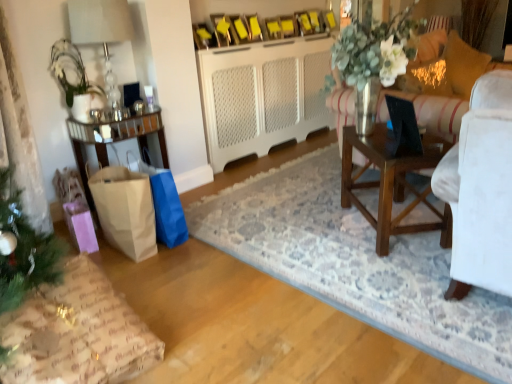
In order to face brown wooden table at center, the second table in the left-to-right sequence, should I rotate leftwards or rightwards?

Turn right approximately 18.102 degrees to face it.

What is the approximate height of white textured cabinet at center?

The height of white textured cabinet at center is 35.87 inches.

Identify the location of gold textured pillow at upper right, which appears as the 2th pillow when viewed from the left. (463, 65).

What do you see at coordinates (403, 128) in the screenshot? I see `black plastic laptop at right` at bounding box center [403, 128].

In order to face black plastic laptop at right, should I rotate leftwards or rightwards?

To face it directly, rotate right by 18.761 degrees.

Locate an element on the screen. The image size is (512, 384). white fabric pillow at upper right, acting as the first pillow starting from the left is located at coordinates (426, 79).

Where is `brown wooden table at center, which ranks as the 1th table in right-to-left order`? brown wooden table at center, which ranks as the 1th table in right-to-left order is located at coordinates (392, 184).

How many degrees apart are the facing directions of white glass lamp at upper left and gold textured pillow at upper right, which appears as the 2th pillow when viewed from the left?

The angle between the facing direction of white glass lamp at upper left and the facing direction of gold textured pillow at upper right, which appears as the 2th pillow when viewed from the left, is 34.2 degrees.

At what (x,y) coordinates should I click in order to perform the action: click on the 1st pillow directly beneath the white glass lamp at upper left (from a real-world perspective). Please return your answer as a coordinate pair (x, y). Looking at the image, I should click on (463, 65).

Which of these two, white glass lamp at upper left or gold textured pillow at upper right, placed as the 1th pillow when sorted from right to left, stands taller?

white glass lamp at upper left.

Which object is thinner, white glass lamp at upper left or gold textured pillow at upper right, which appears as the 2th pillow when viewed from the left?

Thinner between the two is white glass lamp at upper left.

Can brown paper bag at lower left, the 1th shopping bag positioned from the left, be found inside gold textured pillow at upper right, placed as the 1th pillow when sorted from right to left?

No, brown paper bag at lower left, the 1th shopping bag positioned from the left, is not a part of gold textured pillow at upper right, placed as the 1th pillow when sorted from right to left.

Looking at this image, which is in front, gold textured pillow at upper right, which appears as the 2th pillow when viewed from the left, or brown paper bag at lower left, the 2th shopping bag when ordered from right to left?

brown paper bag at lower left, the 2th shopping bag when ordered from right to left, is more forward.

Considering the relative positions of gold textured pillow at upper right, placed as the 1th pillow when sorted from right to left, and brown paper bag at lower left, the 2th shopping bag when ordered from right to left, in the image provided, is gold textured pillow at upper right, placed as the 1th pillow when sorted from right to left, to the left of brown paper bag at lower left, the 2th shopping bag when ordered from right to left, from the viewer's perspective?

In fact, gold textured pillow at upper right, placed as the 1th pillow when sorted from right to left, is to the right of brown paper bag at lower left, the 2th shopping bag when ordered from right to left.

Who is smaller, brown paper bag at lower left, the 2th shopping bag when ordered from right to left, or white fabric pillow at upper right, which is the 2th pillow from right to left?

white fabric pillow at upper right, which is the 2th pillow from right to left, is smaller.

Which shopping bag is the 2nd one when counting from the front of the white fabric pillow at upper right, acting as the first pillow starting from the left? Please provide its 2D coordinates.

[(125, 210)]

From their relative heights in the image, would you say brown paper bag at lower left, the 1th shopping bag positioned from the left, is taller or shorter than white fabric pillow at upper right, acting as the first pillow starting from the left?

brown paper bag at lower left, the 1th shopping bag positioned from the left, is taller than white fabric pillow at upper right, acting as the first pillow starting from the left.

Relative to brown paper bag at left, which is the 1th table from left to right, is white glass lamp at upper left in front or behind?

Clearly, white glass lamp at upper left is in front of brown paper bag at left, which is the 1th table from left to right.

Does white glass lamp at upper left touch brown paper bag at left, which is the 1th table from left to right?

No, white glass lamp at upper left is not making contact with brown paper bag at left, which is the 1th table from left to right.

Is white glass lamp at upper left bigger or smaller than brown paper bag at left, which is the 1th table from left to right?

Considering their sizes, white glass lamp at upper left takes up less space than brown paper bag at left, which is the 1th table from left to right.

Is white fabric pillow at upper right, which is the 2th pillow from right to left, positioned with its back to black plastic laptop at right?

No, white fabric pillow at upper right, which is the 2th pillow from right to left, is not facing away from black plastic laptop at right.

What's the angular difference between white fabric pillow at upper right, which is the 2th pillow from right to left, and black plastic laptop at right's facing directions?

The facing directions of white fabric pillow at upper right, which is the 2th pillow from right to left, and black plastic laptop at right are 67.7 degrees apart.

How much distance is there between white fabric pillow at upper right, which is the 2th pillow from right to left, and black plastic laptop at right?

The distance of white fabric pillow at upper right, which is the 2th pillow from right to left, from black plastic laptop at right is 1.27 meters.

Between white fabric pillow at upper right, which is the 2th pillow from right to left, and black plastic laptop at right, which one appears on the right side from the viewer's perspective?

white fabric pillow at upper right, which is the 2th pillow from right to left, is more to the right.

Would you say brown paper bag at left, the 2th table from the right, is a long distance from wrapping paper gift at lower left?

Yes, brown paper bag at left, the 2th table from the right, and wrapping paper gift at lower left are quite far apart.

Is brown paper bag at left, which is the 1th table from left to right, not within wrapping paper gift at lower left?

Absolutely, brown paper bag at left, which is the 1th table from left to right, is external to wrapping paper gift at lower left.

Is brown paper bag at left, the 2th table from the right, oriented towards wrapping paper gift at lower left?

No, brown paper bag at left, the 2th table from the right, is not turned towards wrapping paper gift at lower left.

From a real-world perspective, is brown paper bag at left, which is the 1th table from left to right, physically located above or below wrapping paper gift at lower left?

brown paper bag at left, which is the 1th table from left to right, is situated higher than wrapping paper gift at lower left in the real world.

How much distance is there between brown paper bag at lower left, the 2th shopping bag when ordered from right to left, and brown paper bag at lower left, the 1th shopping bag from the right?

brown paper bag at lower left, the 2th shopping bag when ordered from right to left, is 13.03 centimeters away from brown paper bag at lower left, the 1th shopping bag from the right.

Considering the sizes of objects brown paper bag at lower left, the 2th shopping bag when ordered from right to left, and brown paper bag at lower left, the 1th shopping bag from the right, in the image provided, who is thinner, brown paper bag at lower left, the 2th shopping bag when ordered from right to left, or brown paper bag at lower left, the 1th shopping bag from the right,?

brown paper bag at lower left, the 1th shopping bag from the right.

In order to click on shopping bag that appears below the brown paper bag at lower left, the 1th shopping bag from the right (from the image's perspective) in this screenshot , I will do `click(125, 210)`.

How many degrees apart are the facing directions of brown paper bag at lower left, the 2th shopping bag when ordered from right to left, and brown paper bag at lower left, the 1th shopping bag from the right?

There is a 1.72-degree angle between the facing directions of brown paper bag at lower left, the 2th shopping bag when ordered from right to left, and brown paper bag at lower left, the 1th shopping bag from the right.

The width and height of the screenshot is (512, 384). What are the coordinates of `pillow that is the 1st one below the white glass lamp at upper left (from a real-world perspective)` in the screenshot? It's located at (463, 65).

This screenshot has width=512, height=384. I want to click on shopping bag that is the 2nd object located below the gold textured pillow at upper right, which appears as the 2th pillow when viewed from the left (from the image's perspective), so click(x=125, y=210).

Based on their spatial positions, is black plastic laptop at right or wrapping paper gift at lower left closer to brown paper bag at lower left, the 2th shopping bag when ordered from right to left?

wrapping paper gift at lower left.

Based on their spatial positions, is black plastic laptop at right or gold textured pillow at upper right, placed as the 1th pillow when sorted from right to left, closer to brown wooden table at center, the second table in the left-to-right sequence?

black plastic laptop at right.

When comparing their distances from brown paper bag at lower left, the 2th shopping bag when ordered from right to left, does white fabric pillow at upper right, acting as the first pillow starting from the left, or brown paper bag at left, which is the 1th table from left to right, seem closer?

Based on the image, brown paper bag at left, which is the 1th table from left to right, appears to be nearer to brown paper bag at lower left, the 2th shopping bag when ordered from right to left.

Which object lies nearer to the anchor point brown paper bag at left, which is the 1th table from left to right, wrapping paper gift at lower left or white glass lamp at upper left?

The object closer to brown paper bag at left, which is the 1th table from left to right, is white glass lamp at upper left.

Based on their spatial positions, is black plastic laptop at right or brown wooden table at center, the second table in the left-to-right sequence, closer to white glass lamp at upper left?

Among the two, black plastic laptop at right is located nearer to white glass lamp at upper left.

From the image, which object appears to be farther from gold textured pillow at upper right, which appears as the 2th pillow when viewed from the left, brown wooden table at center, which ranks as the 1th table in right-to-left order, or white glass lamp at upper left?

white glass lamp at upper left lies further to gold textured pillow at upper right, which appears as the 2th pillow when viewed from the left, than the other object.

When comparing their distances from gold textured pillow at upper right, placed as the 1th pillow when sorted from right to left, does white glass lamp at upper left or brown paper bag at lower left, the 2th shopping bag when ordered from right to left, seem closer?

white glass lamp at upper left.

Estimate the real-world distances between objects in this image. Which object is closer to brown wooden table at center, which ranks as the 1th table in right-to-left order, white glass lamp at upper left or brown paper bag at left, the 2th table from the right?

brown paper bag at left, the 2th table from the right, is closer to brown wooden table at center, which ranks as the 1th table in right-to-left order.

You are a GUI agent. You are given a task and a screenshot of the screen. Output one action in this format:
    pyautogui.click(x=<x>, y=<y>)
    Task: Click on the laptop between brown paper bag at left, which is the 1th table from left to right, and white fabric pillow at upper right, which is the 2th pillow from right to left, from left to right
    The image size is (512, 384).
    Given the screenshot: What is the action you would take?
    pyautogui.click(x=403, y=128)

This screenshot has height=384, width=512. In order to click on laptop between brown paper bag at lower left, the 1th shopping bag positioned from the left, and white fabric pillow at upper right, acting as the first pillow starting from the left, in the horizontal direction in this screenshot , I will do `click(403, 128)`.

Identify the location of cabinetry situated between brown paper bag at lower left, the 1th shopping bag positioned from the left, and brown wooden table at center, the second table in the left-to-right sequence, from left to right. The height and width of the screenshot is (384, 512). (263, 95).

Locate an element on the screen. This screenshot has width=512, height=384. wide between white glass lamp at upper left and brown wooden table at center, which ranks as the 1th table in right-to-left order is located at coordinates (77, 333).